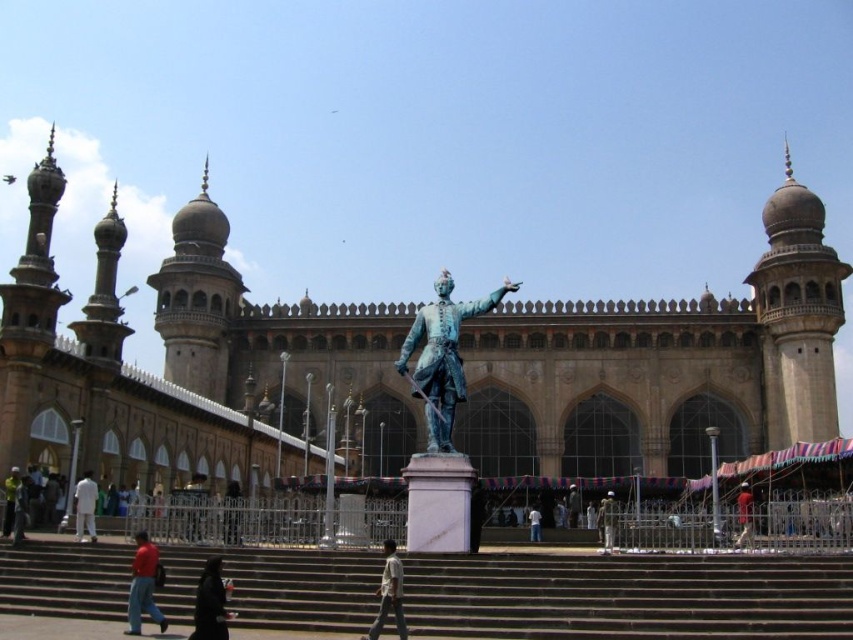
Does beige stone mosque at center come in front of light blue fabric at center?

Yes, beige stone mosque at center is closer to the viewer.

Is beige stone mosque at center shorter than light blue fabric at center?

Incorrect, beige stone mosque at center's height does not fall short of light blue fabric at center's.

Is point (68, 449) in front of point (532, 528)?

That is True.

The image size is (853, 640). I want to click on beige stone mosque at center, so click(x=192, y=362).

Is point (84, 476) behind point (532, 532)?

No, it is not.

Can you confirm if white cotton pants at lower left is bigger than light blue fabric at center?

Yes.

Find the location of `white cotton pants at lower left`. white cotton pants at lower left is located at coordinates (85, 506).

Does beige stone mosque at center appear on the right side of smooth concrete stairs at center?

Indeed, beige stone mosque at center is positioned on the right side of smooth concrete stairs at center.

Is beige stone mosque at center bigger than smooth concrete stairs at center?

Yes, beige stone mosque at center is bigger than smooth concrete stairs at center.

Does point (173, 410) come in front of point (704, 577)?

No, it is behind (704, 577).

Where is `beige stone mosque at center`? Image resolution: width=853 pixels, height=640 pixels. beige stone mosque at center is located at coordinates (x=192, y=362).